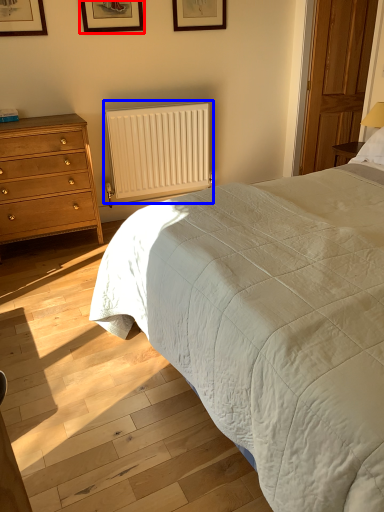
Question: Which of the following is the closest to the observer, picture frame (highlighted by a red box) or radiator (highlighted by a blue box)?

Choices:
 (A) picture frame
 (B) radiator

Answer: (A)